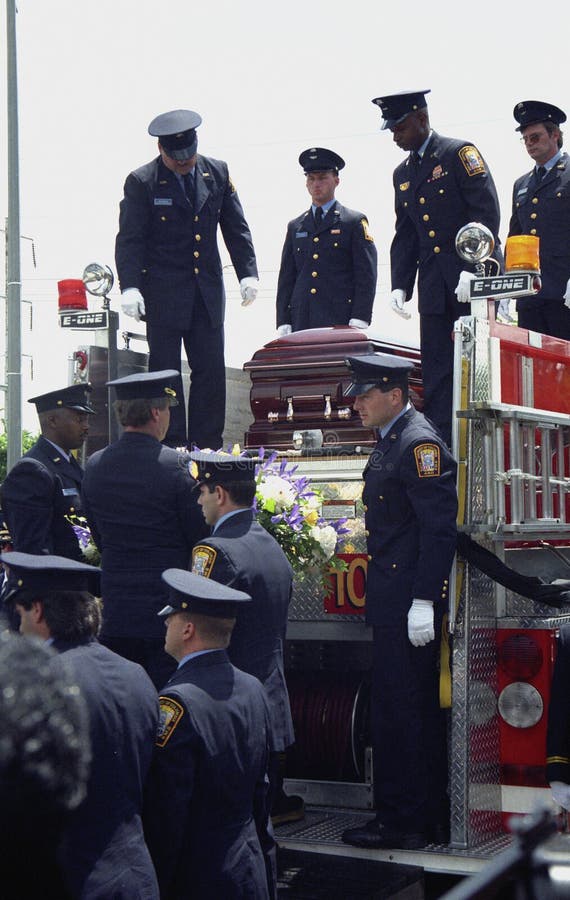
At what (x,y) coordinates should I click in order to perform the action: click on ladder. Please return your answer as a coordinate pair (x, y). This screenshot has width=570, height=900. Looking at the image, I should click on (524, 498).